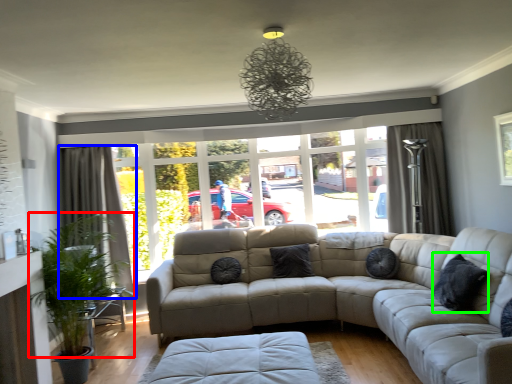
Question: Which object is positioned farthest from plant (highlighted by a red box)? Select from curtain (highlighted by a blue box) and pillow (highlighted by a green box).

Choices:
 (A) curtain
 (B) pillow

Answer: (B)